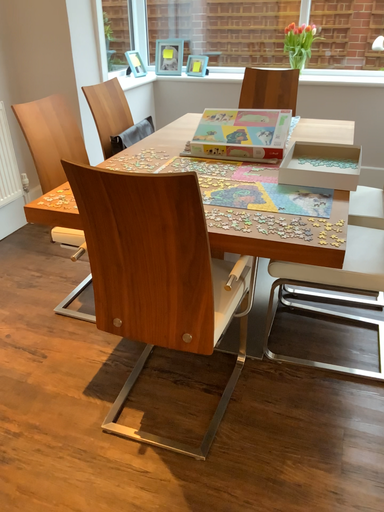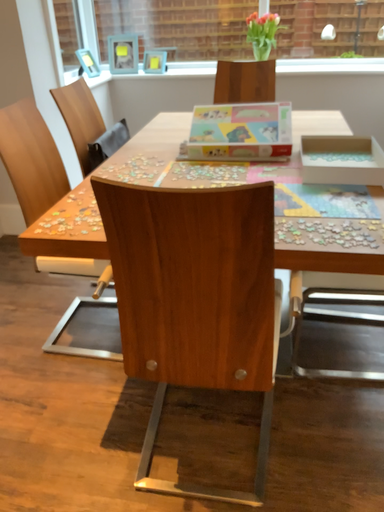
Question: Which way did the camera rotate in the video?

Choices:
 (A) rotated right
 (B) rotated left

Answer: (A)